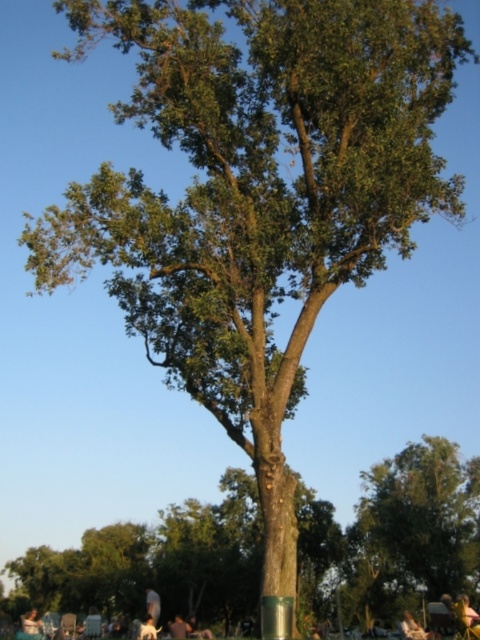
Can you confirm if green rough bark tree at center is bigger than light brown wooden chair at lower left?

Correct, green rough bark tree at center is larger in size than light brown wooden chair at lower left.

In the scene shown: Which is more to the right, green rough bark tree at center or light brown wooden chair at lower left?

Positioned to the right is green rough bark tree at center.

Is point (254, 604) behind point (40, 624)?

That is True.

Where is `green rough bark tree at center`? green rough bark tree at center is located at coordinates (394, 536).

Image resolution: width=480 pixels, height=640 pixels. I want to click on white fur dog at lower center, so click(147, 628).

Does white fur dog at lower center have a lesser width compared to dark gray fabric shirt at lower center?

Indeed, white fur dog at lower center has a lesser width compared to dark gray fabric shirt at lower center.

The height and width of the screenshot is (640, 480). Find the location of `white fur dog at lower center`. white fur dog at lower center is located at coordinates (147, 628).

Locate an element on the screen. The image size is (480, 640). white fur dog at lower center is located at coordinates (147, 628).

The width and height of the screenshot is (480, 640). Find the location of `light brown wooden chair at lower left`. light brown wooden chair at lower left is located at coordinates (31, 627).

Between point (36, 609) and point (175, 625), which one is positioned behind?

The point (36, 609) is behind.

Find the location of `light brown wooden chair at lower left`. light brown wooden chair at lower left is located at coordinates (31, 627).